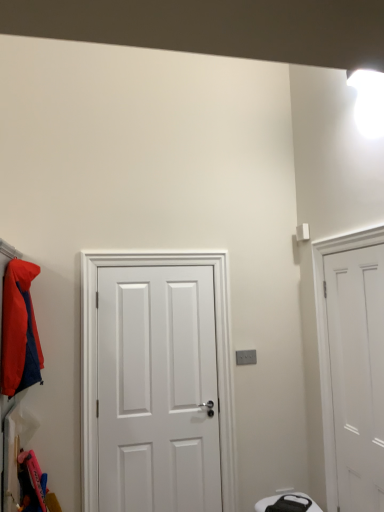
This screenshot has height=512, width=384. What do you see at coordinates (157, 389) in the screenshot? I see `white matte door at center, acting as the 2th door starting from the right` at bounding box center [157, 389].

Identify the location of white matte door at right, placed as the 2th door when sorted from left to right. (357, 373).

Image resolution: width=384 pixels, height=512 pixels. I want to click on matte orange jacket at left, so click(19, 330).

Between matte orange jacket at left and white matte door at center, acting as the 2th door starting from the right, which one has more height?

Standing taller between the two is white matte door at center, acting as the 2th door starting from the right.

Does matte orange jacket at left have a lesser width compared to white matte door at center, which ranks as the 1th door in left-to-right order?

In fact, matte orange jacket at left might be wider than white matte door at center, which ranks as the 1th door in left-to-right order.

Which is more to the right, matte orange jacket at left or white matte door at center, which ranks as the 1th door in left-to-right order?

white matte door at center, which ranks as the 1th door in left-to-right order, is more to the right.

What's the angular difference between matte orange jacket at left and white matte door at center, which ranks as the 1th door in left-to-right order,'s facing directions?

0.159 degrees.

Considering the relative sizes of white matte door at right, marked as the 1th door in a right-to-left arrangement, and matte orange jacket at left in the image provided, is white matte door at right, marked as the 1th door in a right-to-left arrangement, smaller than matte orange jacket at left?

Correct, white matte door at right, marked as the 1th door in a right-to-left arrangement, occupies less space than matte orange jacket at left.

Is white matte door at right, placed as the 2th door when sorted from left to right, looking in the opposite direction of matte orange jacket at left?

No, white matte door at right, placed as the 2th door when sorted from left to right,'s orientation is not away from matte orange jacket at left.

Are white matte door at right, placed as the 2th door when sorted from left to right, and matte orange jacket at left far apart?

Yes, white matte door at right, placed as the 2th door when sorted from left to right, is far from matte orange jacket at left.

How much distance is there between white matte door at right, placed as the 2th door when sorted from left to right, and matte orange jacket at left?

white matte door at right, placed as the 2th door when sorted from left to right, is 1.91 meters from matte orange jacket at left.

Can you tell me how much white matte door at center, acting as the 2th door starting from the right, and matte orange jacket at left differ in facing direction?

0.159 degrees.

Does white matte door at center, which ranks as the 1th door in left-to-right order, have a lesser width compared to matte orange jacket at left?

Yes, white matte door at center, which ranks as the 1th door in left-to-right order, is thinner than matte orange jacket at left.

From a real-world perspective, is white matte door at center, acting as the 2th door starting from the right, on matte orange jacket at left?

No, from a real-world perspective, white matte door at center, acting as the 2th door starting from the right, is not over matte orange jacket at left

At what (x,y) coordinates should I click in order to perform the action: click on jacket lying in front of the white matte door at center, acting as the 2th door starting from the right. Please return your answer as a coordinate pair (x, y). The height and width of the screenshot is (512, 384). Looking at the image, I should click on (19, 330).

Considering the sizes of objects white matte door at center, acting as the 2th door starting from the right, and white matte door at right, placed as the 2th door when sorted from left to right, in the image provided, who is bigger, white matte door at center, acting as the 2th door starting from the right, or white matte door at right, placed as the 2th door when sorted from left to right,?

white matte door at center, acting as the 2th door starting from the right.

Is white matte door at center, which ranks as the 1th door in left-to-right order, oriented towards white matte door at right, placed as the 2th door when sorted from left to right?

No, white matte door at center, which ranks as the 1th door in left-to-right order, is not turned towards white matte door at right, placed as the 2th door when sorted from left to right.

Looking at this image, from a real-world perspective, is white matte door at center, acting as the 2th door starting from the right, under white matte door at right, marked as the 1th door in a right-to-left arrangement?

Yes, from a real-world perspective, white matte door at center, acting as the 2th door starting from the right, is below white matte door at right, marked as the 1th door in a right-to-left arrangement.

Is white matte door at right, placed as the 2th door when sorted from left to right, aimed at white matte door at center, acting as the 2th door starting from the right?

No, white matte door at right, placed as the 2th door when sorted from left to right, is not oriented towards white matte door at center, acting as the 2th door starting from the right.

In the image, is white matte door at right, placed as the 2th door when sorted from left to right, positioned in front of or behind white matte door at center, acting as the 2th door starting from the right?

In the image, white matte door at right, placed as the 2th door when sorted from left to right, appears in front of white matte door at center, acting as the 2th door starting from the right.

Looking at this image, can you confirm if white matte door at right, placed as the 2th door when sorted from left to right, is wider than white matte door at center, acting as the 2th door starting from the right?

No.

Measure the distance between white matte door at right, placed as the 2th door when sorted from left to right, and white matte door at center, which ranks as the 1th door in left-to-right order.

They are 1.12 meters apart.

Does matte orange jacket at left have a lesser width compared to white matte door at right, placed as the 2th door when sorted from left to right?

No.

In the scene shown: Between matte orange jacket at left and white matte door at right, marked as the 1th door in a right-to-left arrangement, which one appears on the right side from the viewer's perspective?

From the viewer's perspective, white matte door at right, marked as the 1th door in a right-to-left arrangement, appears more on the right side.

Could you tell me if matte orange jacket at left is turned towards white matte door at right, marked as the 1th door in a right-to-left arrangement?

No.

From the image's perspective, which object appears higher, matte orange jacket at left or white matte door at right, placed as the 2th door when sorted from left to right?

matte orange jacket at left appears higher in the image.

The width and height of the screenshot is (384, 512). Identify the location of door behind the matte orange jacket at left. (157, 389).

This screenshot has height=512, width=384. Find the location of `jacket above the white matte door at right, marked as the 1th door in a right-to-left arrangement (from the image's perspective)`. jacket above the white matte door at right, marked as the 1th door in a right-to-left arrangement (from the image's perspective) is located at coordinates (19, 330).

Estimate the real-world distances between objects in this image. Which object is further from matte orange jacket at left, white matte door at center, acting as the 2th door starting from the right, or white matte door at right, marked as the 1th door in a right-to-left arrangement?

white matte door at right, marked as the 1th door in a right-to-left arrangement, is positioned further to the anchor matte orange jacket at left.

Looking at the image, which one is located closer to white matte door at center, acting as the 2th door starting from the right, matte orange jacket at left or white matte door at right, placed as the 2th door when sorted from left to right?

matte orange jacket at left.

Which object lies nearer to the anchor point white matte door at right, marked as the 1th door in a right-to-left arrangement, white matte door at center, which ranks as the 1th door in left-to-right order, or matte orange jacket at left?

Among the two, white matte door at center, which ranks as the 1th door in left-to-right order, is located nearer to white matte door at right, marked as the 1th door in a right-to-left arrangement.

When comparing their distances from matte orange jacket at left, does white matte door at right, marked as the 1th door in a right-to-left arrangement, or white matte door at center, which ranks as the 1th door in left-to-right order, seem closer?

white matte door at center, which ranks as the 1th door in left-to-right order.

Based on their spatial positions, is white matte door at right, marked as the 1th door in a right-to-left arrangement, or matte orange jacket at left closer to white matte door at center, which ranks as the 1th door in left-to-right order?

matte orange jacket at left.

Which object lies nearer to the anchor point white matte door at right, marked as the 1th door in a right-to-left arrangement, matte orange jacket at left or white matte door at center, which ranks as the 1th door in left-to-right order?

Among the two, white matte door at center, which ranks as the 1th door in left-to-right order, is located nearer to white matte door at right, marked as the 1th door in a right-to-left arrangement.

At what (x,y) coordinates should I click in order to perform the action: click on door situated between matte orange jacket at left and white matte door at right, marked as the 1th door in a right-to-left arrangement, from left to right. Please return your answer as a coordinate pair (x, y). Looking at the image, I should click on (157, 389).